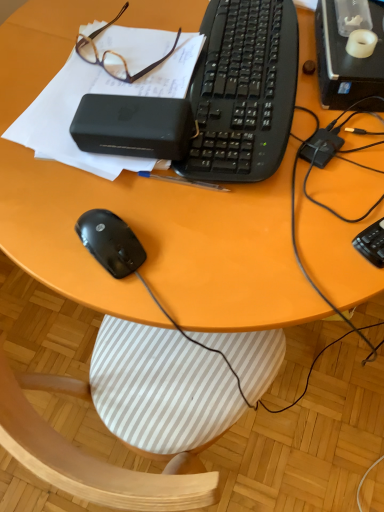
Where is `vacant space situated on the left part of black matte mouse at lower left`? Image resolution: width=384 pixels, height=512 pixels. vacant space situated on the left part of black matte mouse at lower left is located at coordinates (44, 232).